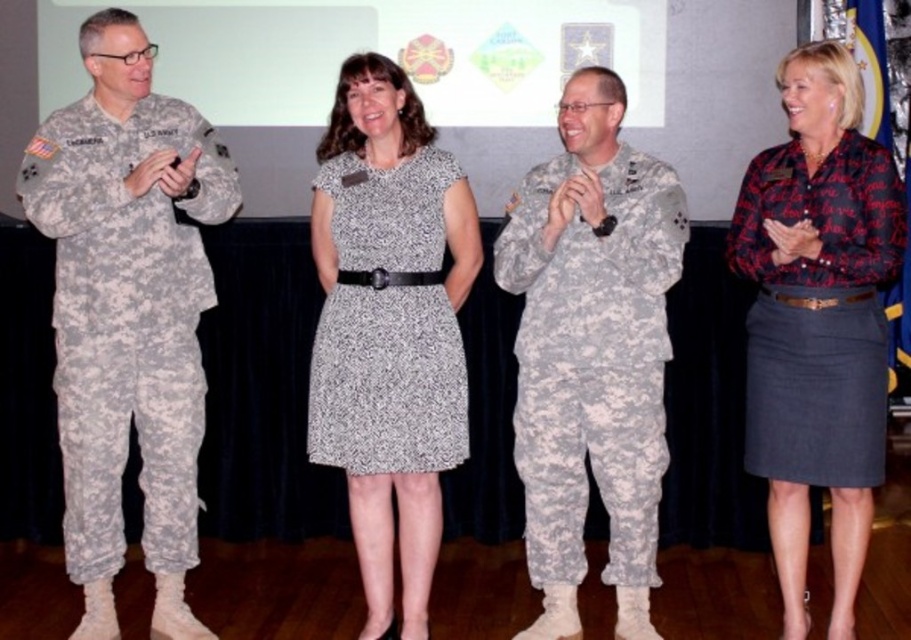
Between point (145, 76) and point (565, 493), which one is positioned behind?

The point (565, 493) is more distant.

Between point (182, 522) and point (641, 563), which one is positioned in front?

Positioned in front is point (641, 563).

Is point (128, 125) positioned behind point (553, 508)?

No.

Locate an element on the screen. camouflage uniform at left is located at coordinates (128, 312).

Is point (794, 145) farther from camera compared to point (319, 368)?

No.

Who is more forward, (794, 621) or (333, 368)?

Point (794, 621) is in front.

You are a GUI agent. You are given a task and a screenshot of the screen. Output one action in this format:
    pyautogui.click(x=<x>, y=<y>)
    Task: Click on the printed cotton blouse at center
    The height and width of the screenshot is (640, 911).
    Given the screenshot: What is the action you would take?
    pyautogui.click(x=817, y=321)

Identify the location of printed cotton blouse at center. The width and height of the screenshot is (911, 640). (817, 321).

Is point (203, 186) farther from viewer compared to point (401, 356)?

Yes, it is behind point (401, 356).

This screenshot has height=640, width=911. Describe the element at coordinates (128, 312) in the screenshot. I see `camouflage uniform at left` at that location.

Identify the location of camouflage uniform at left. (128, 312).